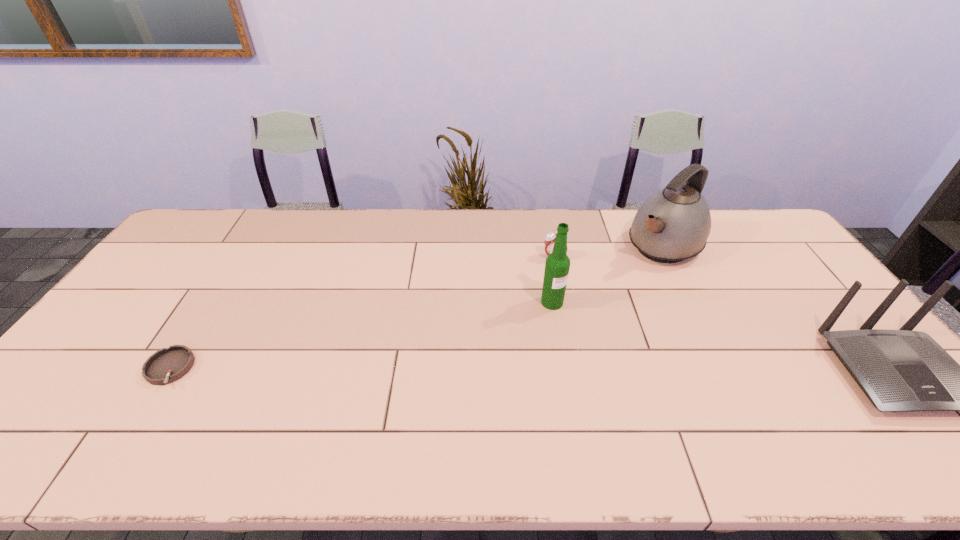
In order to click on free location located 0.370m on the clock face of the alarm clock in this screenshot , I will do `click(560, 349)`.

Identify the location of free location located on the clock face of the alarm clock. (556, 295).

The height and width of the screenshot is (540, 960). Find the location of `free space located 0.090m at the spout of the second object from right to left`. free space located 0.090m at the spout of the second object from right to left is located at coordinates (626, 275).

This screenshot has height=540, width=960. I want to click on vacant area located 0.080m at the spout of the second object from right to left, so click(x=628, y=274).

In order to click on vacant space positioned 0.100m at the spout of the second object from right to left in this screenshot , I will do `click(625, 277)`.

Locate an element on the screen. object present at the far edge is located at coordinates (673, 224).

The image size is (960, 540). What are the coordinates of `object present at the near edge` in the screenshot? It's located at (167, 365).

This screenshot has height=540, width=960. I want to click on vacant space at the far edge, so click(x=290, y=238).

In the image, there is a desktop. Find the location of `vacant space at the near edge`. vacant space at the near edge is located at coordinates (285, 393).

Locate an element on the screen. The height and width of the screenshot is (540, 960). free space at the left edge of the desktop is located at coordinates (196, 281).